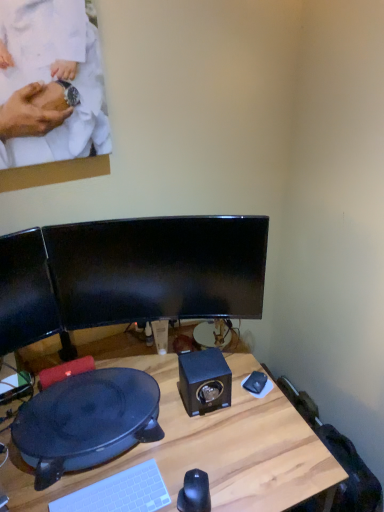
Question: Does wooden desk at center turn towards black matte speaker at center?

Choices:
 (A) yes
 (B) no

Answer: (B)

Question: Considering the relative positions of wooden desk at center and black matte speaker at center in the image provided, is wooden desk at center behind black matte speaker at center?

Choices:
 (A) no
 (B) yes

Answer: (A)

Question: Is wooden desk at center next to black matte speaker at center?

Choices:
 (A) no
 (B) yes

Answer: (A)

Question: Is wooden desk at center at the left side of black matte speaker at center?

Choices:
 (A) yes
 (B) no

Answer: (A)

Question: Does wooden desk at center have a lesser width compared to black matte speaker at center?

Choices:
 (A) yes
 (B) no

Answer: (B)

Question: Can we say wooden desk at center lies outside black matte speaker at center?

Choices:
 (A) no
 (B) yes

Answer: (B)

Question: Considering the relative positions of black plastic wok at lower left and wooden desk at center in the image provided, is black plastic wok at lower left to the left of wooden desk at center from the viewer's perspective?

Choices:
 (A) no
 (B) yes

Answer: (B)

Question: Is black plastic wok at lower left taller than wooden desk at center?

Choices:
 (A) yes
 (B) no

Answer: (B)

Question: Does black plastic wok at lower left come behind wooden desk at center?

Choices:
 (A) yes
 (B) no

Answer: (A)

Question: From the image's perspective, is black plastic wok at lower left over wooden desk at center?

Choices:
 (A) no
 (B) yes

Answer: (B)

Question: Considering the relative sizes of black plastic wok at lower left and wooden desk at center in the image provided, is black plastic wok at lower left wider than wooden desk at center?

Choices:
 (A) yes
 (B) no

Answer: (B)

Question: Is black plastic wok at lower left at the right side of wooden desk at center?

Choices:
 (A) yes
 (B) no

Answer: (B)

Question: From a real-world perspective, is black glossy mouse at lower center on black matte speaker at center?

Choices:
 (A) no
 (B) yes

Answer: (A)